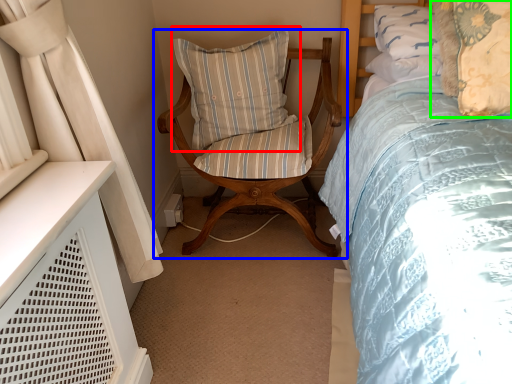
Question: Which is nearer to the pillow (highlighted by a red box)? chair (highlighted by a blue box) or pillow (highlighted by a green box).

Choices:
 (A) chair
 (B) pillow

Answer: (A)